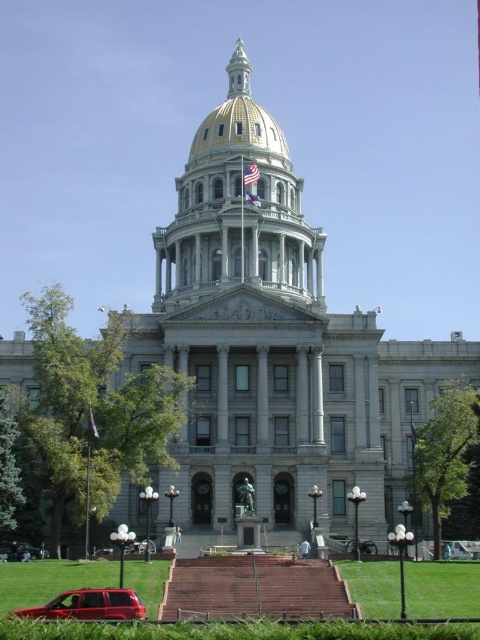
Question: Does white fabric flag at center have a smaller size compared to silky fabric flag at center?

Choices:
 (A) yes
 (B) no

Answer: (B)

Question: Which of these objects is positioned farthest from the matte red suv at lower left?

Choices:
 (A) white fabric flag at center
 (B) silky fabric flag at center
 (C) metallic silver car at lower right

Answer: (A)

Question: Estimate the real-world distances between objects in this image. Which object is farther from the silky fabric flag at center?

Choices:
 (A) metallic silver car at lower right
 (B) white fabric flag at center
 (C) matte red suv at lower left
 (D) blue fabric flag at center

Answer: (B)

Question: Does white fabric flag at center appear under blue fabric flag at center?

Choices:
 (A) no
 (B) yes

Answer: (A)

Question: Estimate the real-world distances between objects in this image. Which object is closer to the blue fabric flag at center?

Choices:
 (A) white fabric flag at center
 (B) metallic silver car at lower right
 (C) silky fabric flag at center

Answer: (A)

Question: Is matte red suv at lower left thinner than blue fabric flag at center?

Choices:
 (A) no
 (B) yes

Answer: (A)